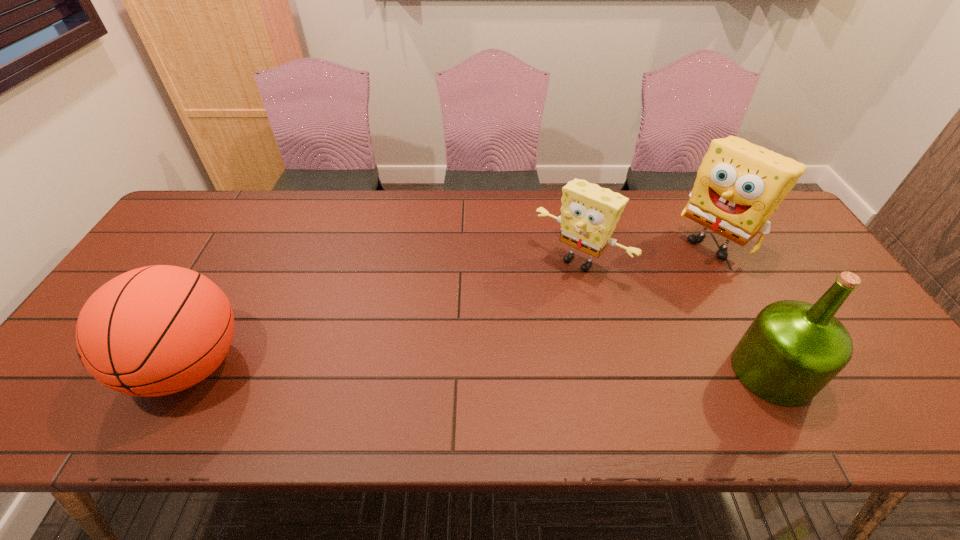
Image resolution: width=960 pixels, height=540 pixels. Identify the location of vacant space on the desktop that is between the leftmost object and the olive oil and is positioned on the face of the shorter sponge. (486, 369).

Find the location of a particular element. This screenshot has height=540, width=960. free spot on the desktop that is between the leftmost object and the olive oil and is positioned on the face of the taller sponge is located at coordinates (563, 369).